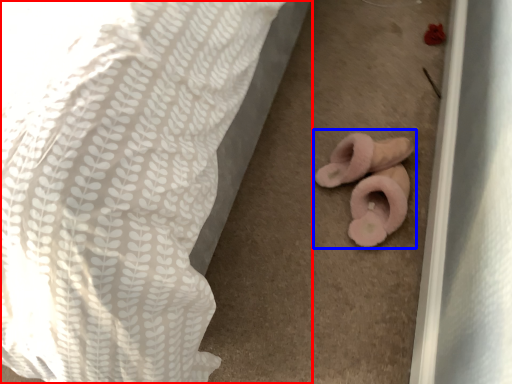
Question: Among these objects, which one is nearest to the camera, bed (highlighted by a red box) or stuff (highlighted by a blue box)?

Choices:
 (A) bed
 (B) stuff

Answer: (A)